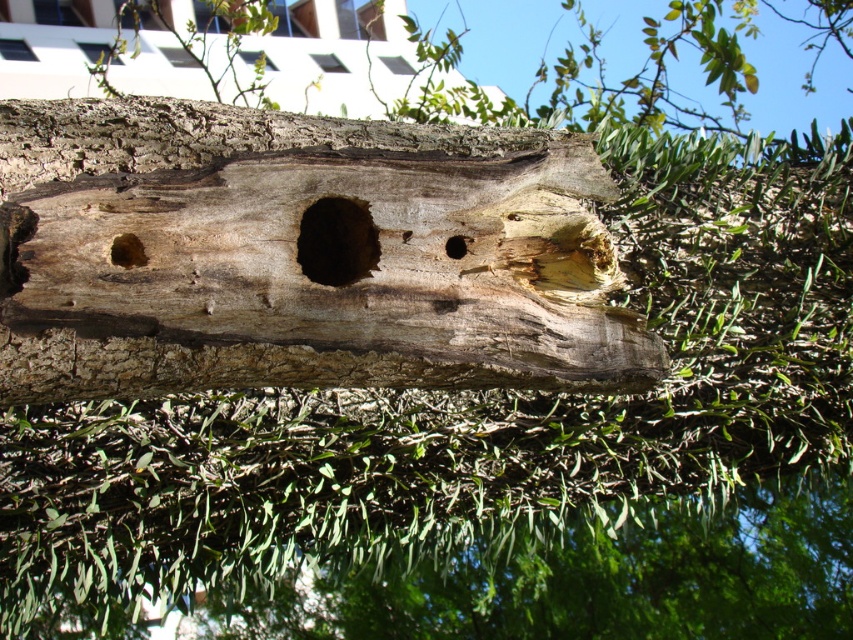
Question: From the image, what is the correct spatial relationship of weathered wood log at center in relation to brown rough hole at center?

Choices:
 (A) above
 (B) below

Answer: (B)

Question: Which object appears closest to the camera in this image?

Choices:
 (A) brown rough hole at center
 (B) smooth brown hole at center
 (C) brown rough hole at left
 (D) weathered wood log at center

Answer: (D)

Question: Is brown rough hole at center thinner than brown rough hole at left?

Choices:
 (A) yes
 (B) no

Answer: (B)

Question: Among these objects, which one is farthest from the camera?

Choices:
 (A) brown rough hole at left
 (B) brown rough hole at center

Answer: (B)

Question: Is weathered wood log at center positioned at the back of smooth brown hole at center?

Choices:
 (A) yes
 (B) no

Answer: (B)

Question: Which of the following is the closest to the observer?

Choices:
 (A) (144, 257)
 (B) (457, 237)
 (C) (314, 280)

Answer: (A)